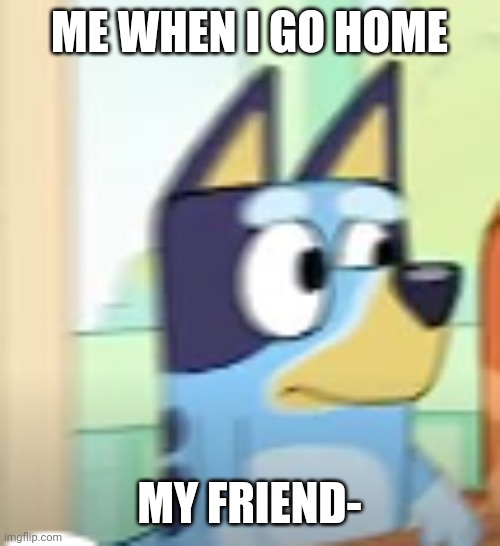
Where is `light green wall`? Image resolution: width=500 pixels, height=546 pixels. light green wall is located at coordinates (450, 116).